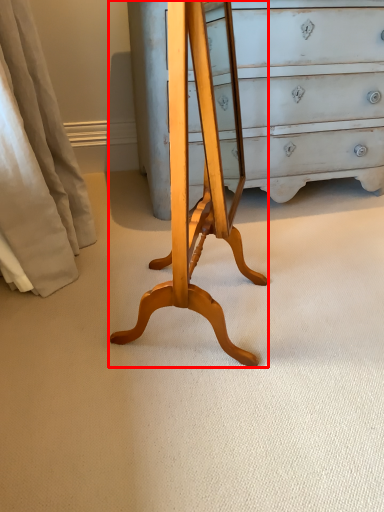
Question: From the image's perspective, where is changing table (annotated by the red box) located in relation to curtain in the image?

Choices:
 (A) below
 (B) above

Answer: (A)